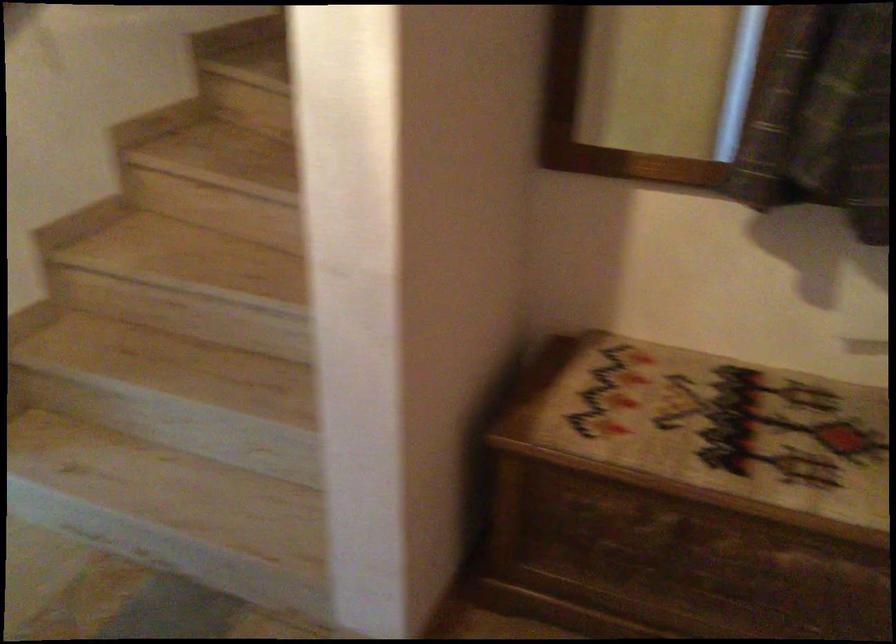
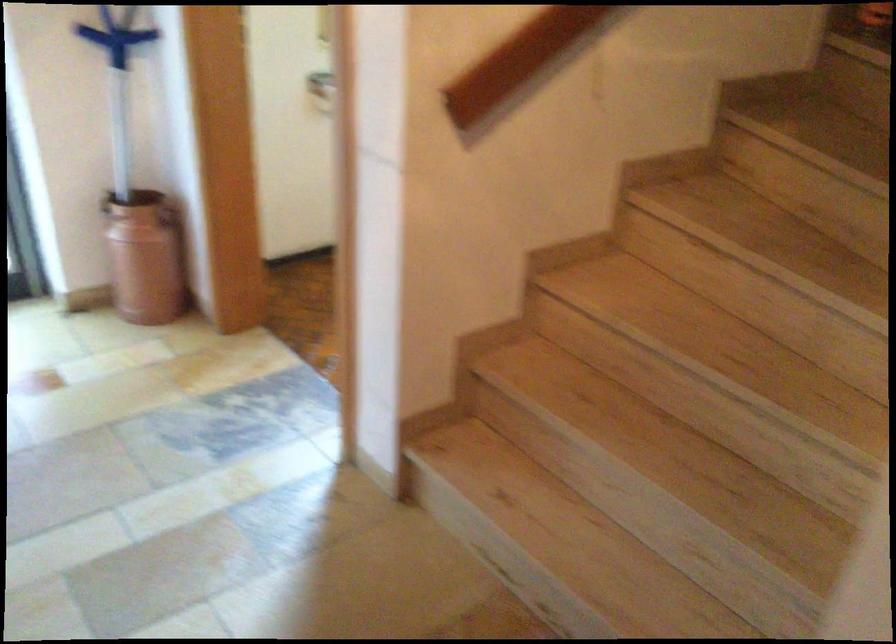
Question: The images are taken continuously from a first-person perspective. In which direction are you moving?

Choices:
 (A) Left
 (B) Right
 (C) Forward
 (D) Backward

Answer: (A)